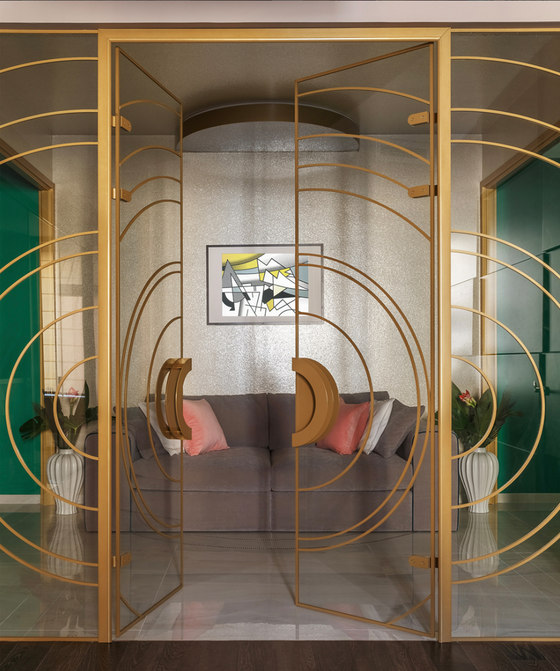
You are a GUI agent. You are given a task and a screenshot of the screen. Output one action in this format:
    pyautogui.click(x=<x>, y=<y>)
    Task: Click on the flower vases
    
    Given the screenshot: What is the action you would take?
    pyautogui.click(x=65, y=480), pyautogui.click(x=478, y=478)